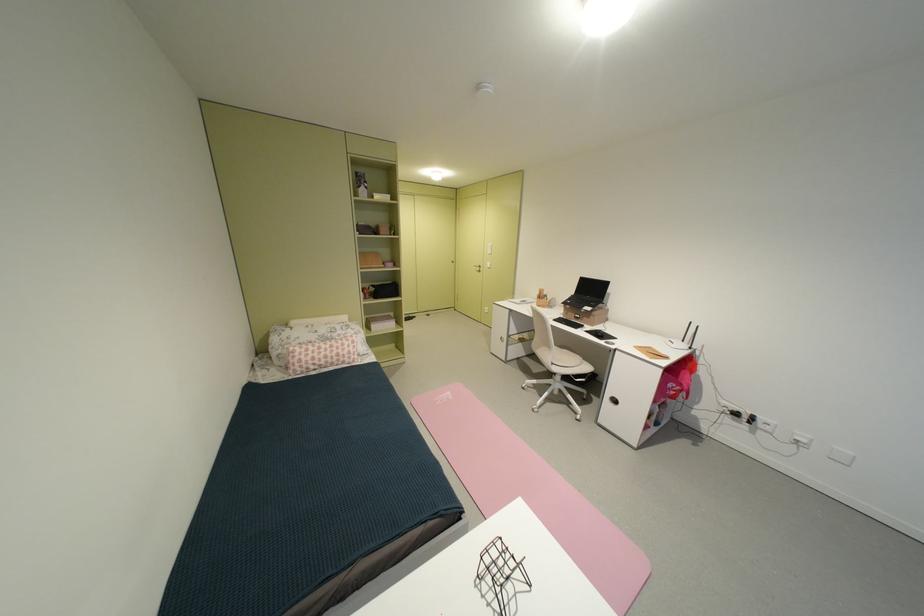
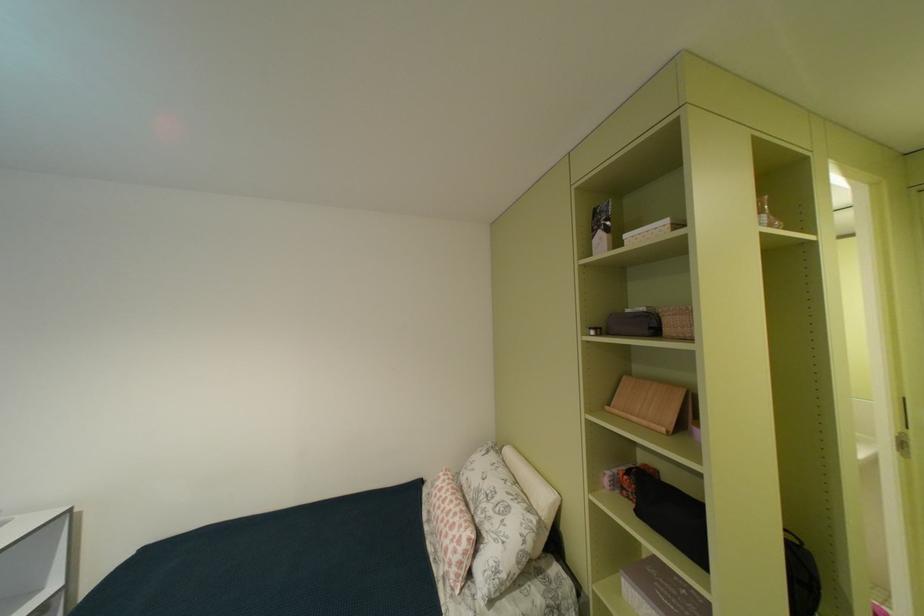
In the second image, find the point that corresponds to (x=398, y=197) in the first image.

(676, 223)